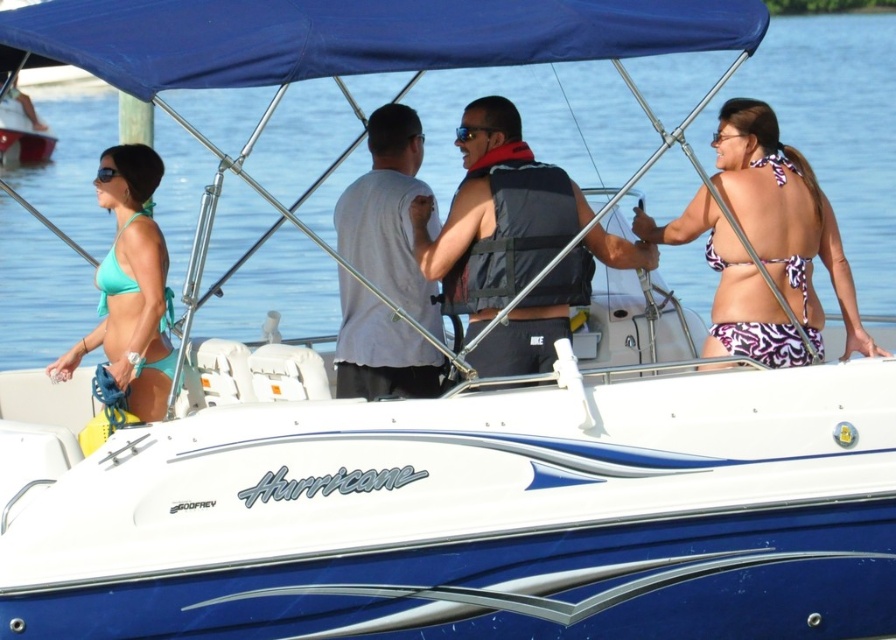
Question: Which object is positioned farthest from the teal bikini top at left?

Choices:
 (A) dark gray life vest at center
 (B) purple printed bikini top at right
 (C) gray cotton t-shirt at center
 (D) blue fabric canopy at upper center

Answer: (D)

Question: Considering the real-world distances, which object is farthest from the blue fabric canopy at upper center?

Choices:
 (A) purple printed bikini top at right
 (B) dark gray life vest at center
 (C) teal bikini top at left

Answer: (C)

Question: Is purple printed bikini top at right closer to the viewer compared to gray cotton t-shirt at center?

Choices:
 (A) no
 (B) yes

Answer: (A)

Question: Considering the relative positions of blue fabric canopy at upper center and gray cotton t-shirt at center in the image provided, where is blue fabric canopy at upper center located with respect to gray cotton t-shirt at center?

Choices:
 (A) right
 (B) left

Answer: (A)

Question: Which point is farther to the camera?

Choices:
 (A) (797, 266)
 (B) (464, 292)
 (C) (524, 61)

Answer: (A)

Question: Is blue fabric canopy at upper center further to camera compared to teal bikini top at left?

Choices:
 (A) no
 (B) yes

Answer: (A)